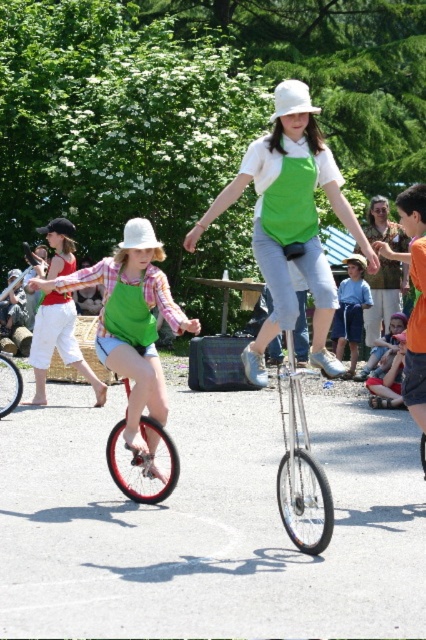
Is point (290, 285) closer to viewer compared to point (149, 355)?

Yes, it is.

Does green matte apron at center lie behind matte green apron at center?

No, green matte apron at center is in front of matte green apron at center.

Is point (285, 172) positioned behind point (184, 326)?

No, it is in front of (184, 326).

What are the coordinates of `green matte apron at center` in the screenshot? It's located at (290, 221).

Does point (304, 116) lie behind point (336, 317)?

No, it is not.

Can you confirm if green matte apron at center is positioned to the right of blue denim shorts at center?

Incorrect, green matte apron at center is not on the right side of blue denim shorts at center.

The width and height of the screenshot is (426, 640). What do you see at coordinates (290, 221) in the screenshot?
I see `green matte apron at center` at bounding box center [290, 221].

The height and width of the screenshot is (640, 426). I want to click on green matte apron at center, so click(x=290, y=221).

Does blue denim shorts at center have a lesser width compared to green fabric dress at center?

Indeed, blue denim shorts at center has a lesser width compared to green fabric dress at center.

Is blue denim shorts at center shorter than green fabric dress at center?

Incorrect, blue denim shorts at center's height does not fall short of green fabric dress at center's.

Find the location of a particular element. blue denim shorts at center is located at coordinates (351, 310).